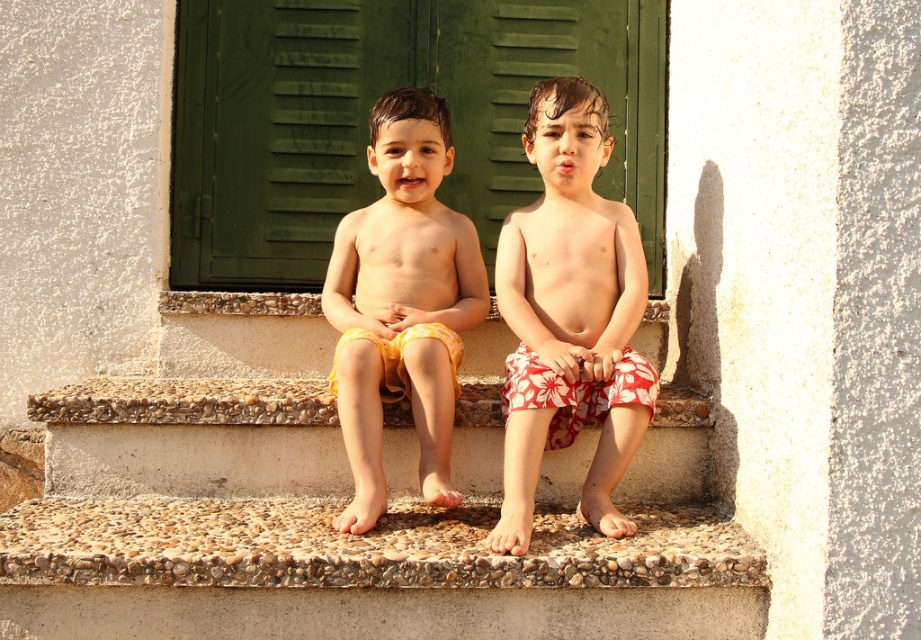
Question: Among these points, which one is nearest to the camera?

Choices:
 (A) (374, 376)
 (B) (577, 600)

Answer: (B)

Question: Can you confirm if smooth stone stairs at center is positioned below red floral shorts at center?

Choices:
 (A) no
 (B) yes

Answer: (B)

Question: Where is green matte shutter at center located in relation to yellow cotton shorts at center in the image?

Choices:
 (A) left
 (B) right

Answer: (A)

Question: Which point is farther to the camera?

Choices:
 (A) (492, 211)
 (B) (442, 513)
 (C) (352, 294)

Answer: (A)

Question: Is smooth stone stairs at center in front of yellow cotton shorts at center?

Choices:
 (A) no
 (B) yes

Answer: (B)

Question: Which point is farther from the camera taking this photo?

Choices:
 (A) (566, 76)
 (B) (377, 282)
 (C) (236, 609)
 (D) (354, 186)

Answer: (D)